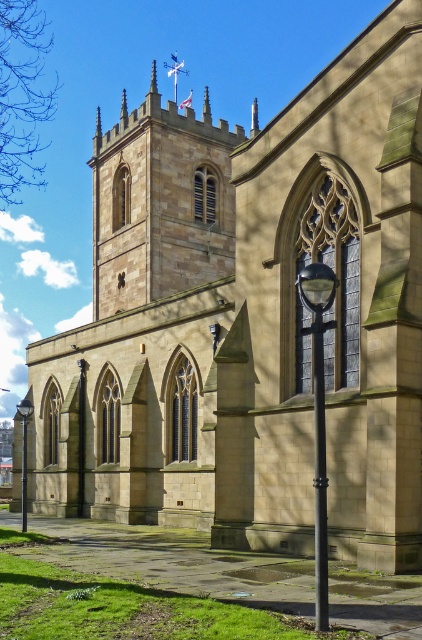
Looking at this image, which of these two, black metal pole at lower center or black glass lamp post at lower left, stands shorter?

Standing shorter between the two is black glass lamp post at lower left.

Looking at this image, between black metal pole at lower center and black glass lamp post at lower left, which one has more height?

Standing taller between the two is black metal pole at lower center.

Is point (321, 620) farther from camera compared to point (32, 410)?

No, (321, 620) is in front of (32, 410).

I want to click on black metal pole at lower center, so click(319, 474).

Can you confirm if black metal/texture lamp post at center-right is smaller than black glass lamp post at lower left?

Indeed, black metal/texture lamp post at center-right has a smaller size compared to black glass lamp post at lower left.

Which is below, black metal/texture lamp post at center-right or black glass lamp post at lower left?

Answer: black glass lamp post at lower left is below.

Between point (321, 563) and point (23, 420), which one is positioned behind?

Point (23, 420)

Locate an element on the screen. The height and width of the screenshot is (640, 422). black metal/texture lamp post at center-right is located at coordinates (319, 417).

Between black metal/texture lamp post at center-right and black metal pole at lower center, which one appears on the left side from the viewer's perspective?

black metal pole at lower center

Who is more distant from viewer, (306, 304) or (321, 323)?

Positioned behind is point (306, 304).

At what (x,y) coordinates should I click in order to perform the action: click on black metal/texture lamp post at center-right. Please return your answer as a coordinate pair (x, y). The width and height of the screenshot is (422, 640). Looking at the image, I should click on (319, 417).